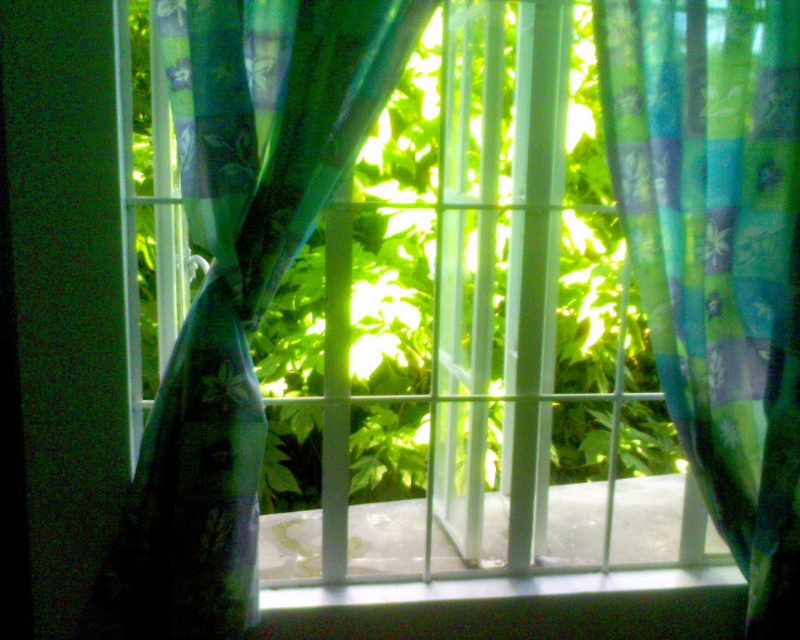
Can you confirm if translucent floral fabric at center is taller than white smooth concrete at center?

Yes.

Is translucent floral fabric at center positioned behind white smooth concrete at center?

No, it is not.

Find the location of a particular element. The image size is (800, 640). translucent floral fabric at center is located at coordinates (240, 276).

Is point (202, 358) closer to camera compared to point (713, 67)?

Yes, it is in front of point (713, 67).

Does translucent floral fabric at center have a lesser width compared to translucent floral-patterned curtain at right?

No, translucent floral fabric at center is not thinner than translucent floral-patterned curtain at right.

Where is `translucent floral fabric at center`? The height and width of the screenshot is (640, 800). translucent floral fabric at center is located at coordinates (240, 276).

Where is `translucent floral fabric at center`? The width and height of the screenshot is (800, 640). translucent floral fabric at center is located at coordinates (240, 276).

Does translucent floral-patterned curtain at right have a lesser height compared to white smooth concrete at center?

No, translucent floral-patterned curtain at right is not shorter than white smooth concrete at center.

Locate an element on the screen. translucent floral-patterned curtain at right is located at coordinates (718, 256).